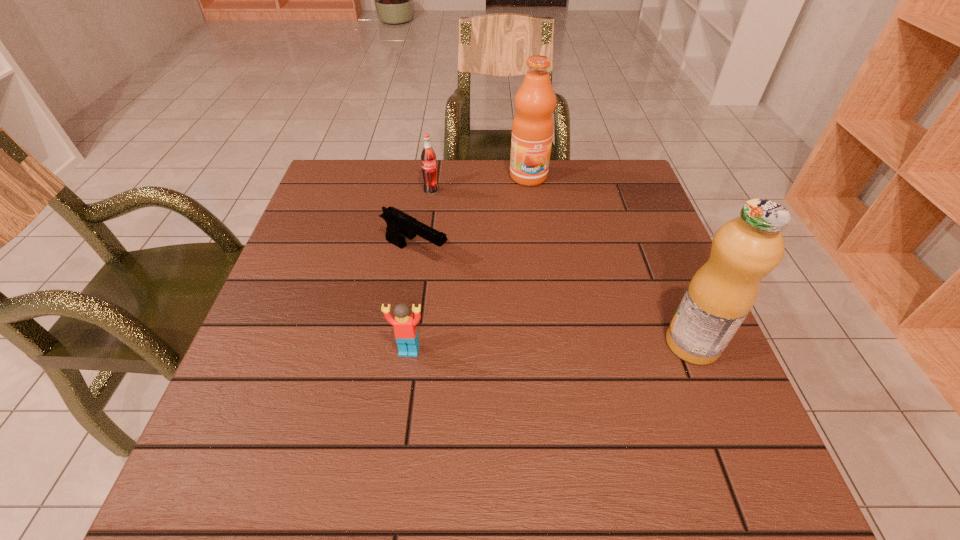
Find the location of a particular element. The height and width of the screenshot is (540, 960). free space located 0.140m on the front label of the rightmost object is located at coordinates (595, 344).

This screenshot has width=960, height=540. What are the coordinates of `blank space located on the front label of the rightmost object` in the screenshot? It's located at (560, 344).

The image size is (960, 540). I want to click on vacant area located 0.280m on the label side of the second object from right to left, so click(x=557, y=254).

Locate an element on the screen. vacant space located 0.140m on the label side of the second object from right to left is located at coordinates (543, 218).

Find the location of a particular element. Image resolution: width=960 pixels, height=540 pixels. vacant space positioned on the label side of the second object from right to left is located at coordinates (561, 266).

This screenshot has height=540, width=960. I want to click on vacant point located 0.050m on the label of the soda bottle, so click(x=442, y=204).

You are a GUI agent. You are given a task and a screenshot of the screen. Output one action in this format:
    pyautogui.click(x=<x>, y=<y>)
    Task: Click on the vacant space located 0.220m on the label of the soda bottle
    The width and height of the screenshot is (960, 540).
    Given the screenshot: What is the action you would take?
    pyautogui.click(x=469, y=241)

You are a GUI agent. You are given a task and a screenshot of the screen. Output one action in this format:
    pyautogui.click(x=<x>, y=<y>)
    Task: Click on the vacant space located on the label of the soda bottle
    The image size is (960, 540).
    Given the screenshot: What is the action you would take?
    pyautogui.click(x=444, y=206)

In order to click on free region located 0.300m on the front-facing side of the shortest object in this screenshot , I will do `click(555, 326)`.

The height and width of the screenshot is (540, 960). Find the location of `vacant space located on the front-facing side of the shortest object`. vacant space located on the front-facing side of the shortest object is located at coordinates coord(526,310).